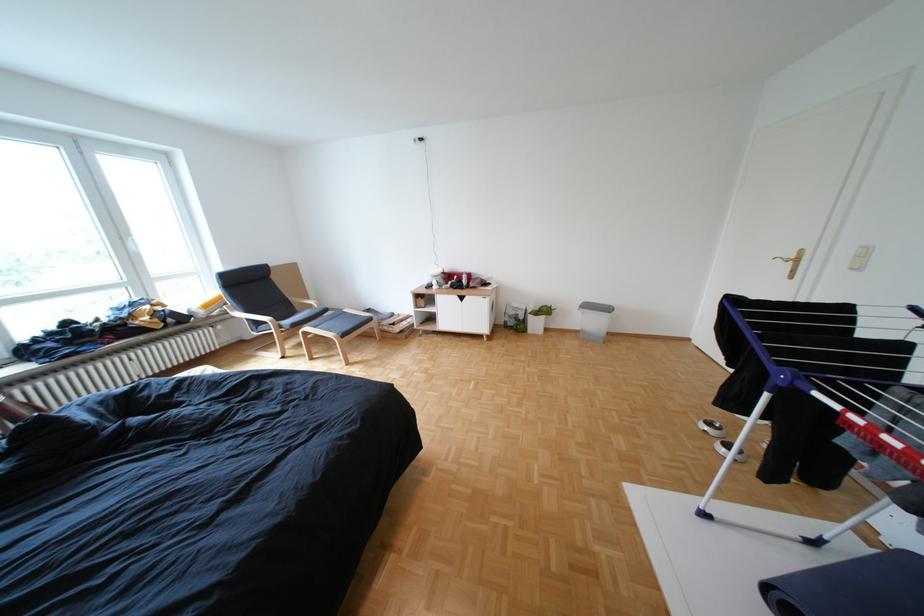
What do you see at coordinates (792, 262) in the screenshot? The height and width of the screenshot is (616, 924). I see `the brass door handle` at bounding box center [792, 262].